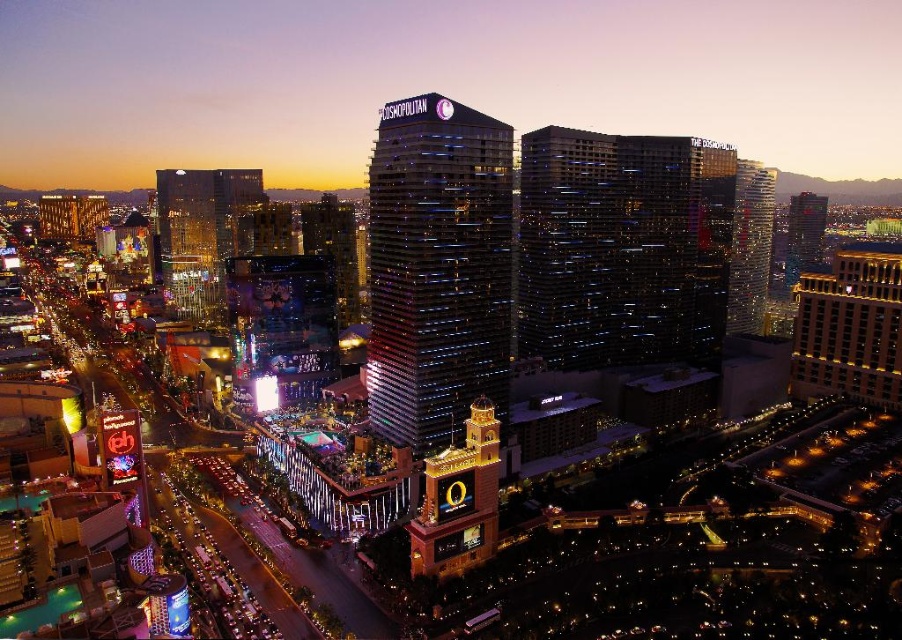
Who is more distant from viewer, (494,224) or (854,285)?

The point (854,285) is behind.

Can you confirm if shiny glass skyscraper at center is taller than gold brick building at upper right?

Yes, shiny glass skyscraper at center is taller than gold brick building at upper right.

At what (x,y) coordinates should I click in order to perform the action: click on shiny glass skyscraper at center. Please return your answer as a coordinate pair (x, y). The image size is (902, 640). Looking at the image, I should click on click(x=437, y=268).

In the scene shown: Does reflective glass skyscraper at center have a lesser width compared to metallic glass skyscraper at upper right?

Incorrect, reflective glass skyscraper at center's width is not less than metallic glass skyscraper at upper right's.

Between point (661, 356) and point (747, 218), which one is positioned in front?

Positioned in front is point (661, 356).

Identify the location of reflective glass skyscraper at center. The width and height of the screenshot is (902, 640). (621, 248).

Does golden brick clock tower at center come behind metallic glass skyscraper at upper right?

No, golden brick clock tower at center is in front of metallic glass skyscraper at upper right.

Does golden brick clock tower at center have a lesser height compared to metallic glass skyscraper at upper right?

Correct, golden brick clock tower at center is not as tall as metallic glass skyscraper at upper right.

Measure the distance between point (439, 568) and camera.

Point (439, 568) and camera are 104.08 meters apart.

You are a GUI agent. You are given a task and a screenshot of the screen. Output one action in this format:
    pyautogui.click(x=<x>, y=<y>)
    Task: Click on the golden brick clock tower at center
    The height and width of the screenshot is (640, 902).
    Given the screenshot: What is the action you would take?
    pyautogui.click(x=459, y=500)